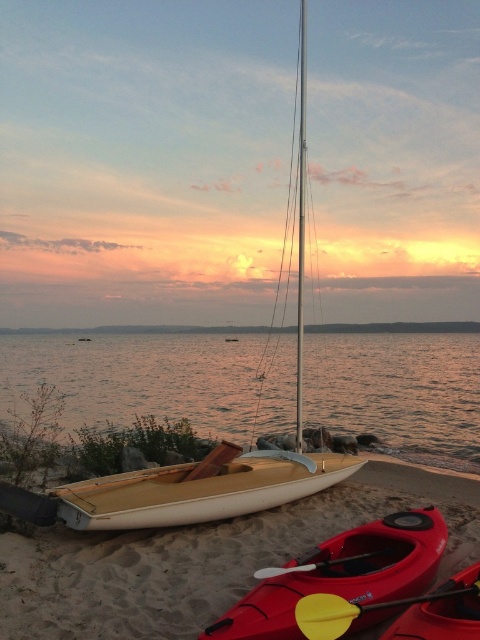
Question: Can you confirm if beige sand at center is positioned below matte red kayak at lower center?

Choices:
 (A) yes
 (B) no

Answer: (A)

Question: Based on their relative distances, which object is nearer to the wooden canoe at center?

Choices:
 (A) matte red kayak at lower center
 (B) beige sand at center
 (C) smooth water at center
 (D) wooden sailboat at center

Answer: (B)

Question: Does smooth water at center have a greater width compared to wooden canoe at center?

Choices:
 (A) yes
 (B) no

Answer: (A)

Question: Which point is closer to the camera?

Choices:
 (A) (283, 412)
 (B) (303, 148)
 (C) (254, 486)
 (D) (319, 586)

Answer: (D)

Question: Does beige sand at center have a larger size compared to matte red canoe at lower right?

Choices:
 (A) no
 (B) yes

Answer: (A)

Question: Which point is closer to the camera?

Choices:
 (A) (357, 460)
 (B) (437, 621)
 (C) (0, 582)
 (D) (97, 481)

Answer: (B)